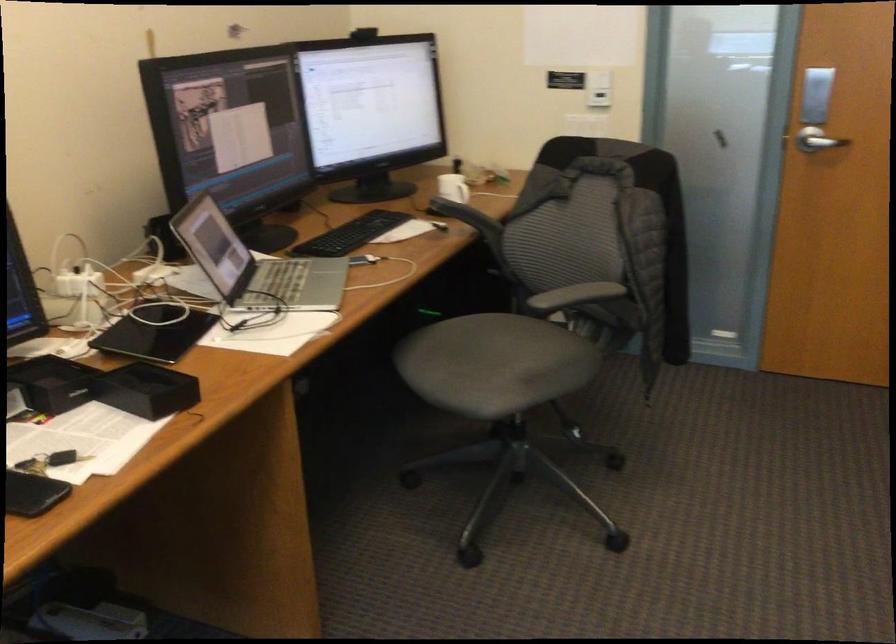
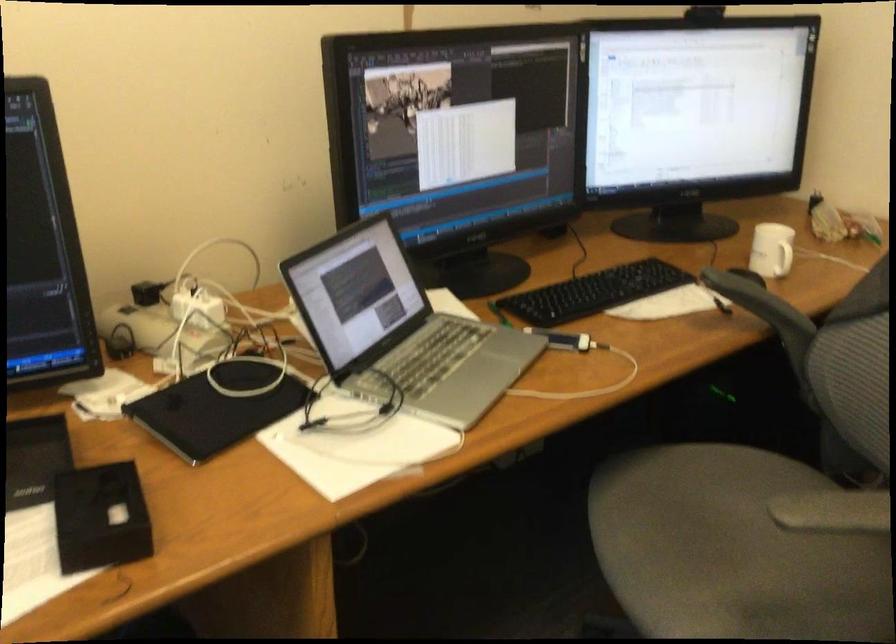
Where in the second image is the point corresponding to pixel 142 388 from the first image?

(100, 518)